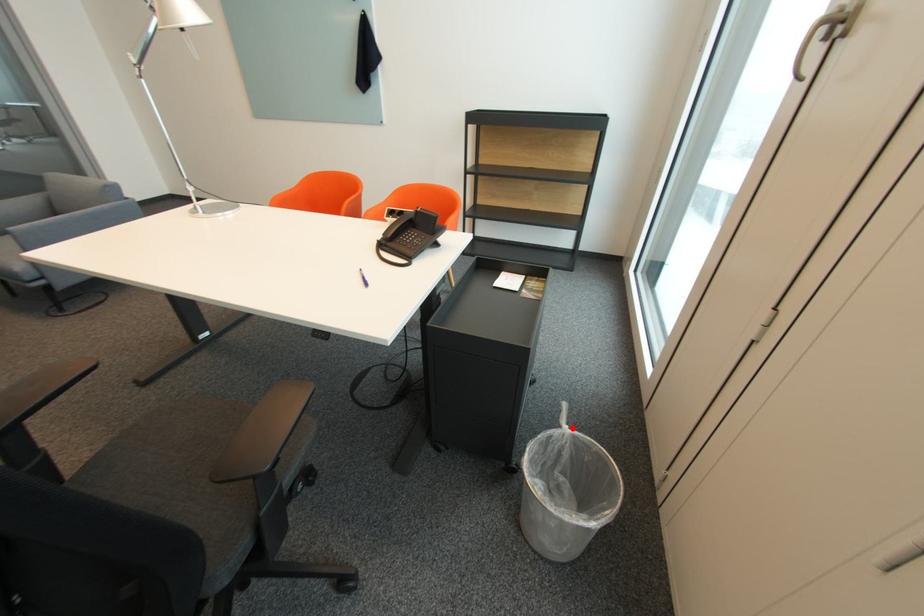
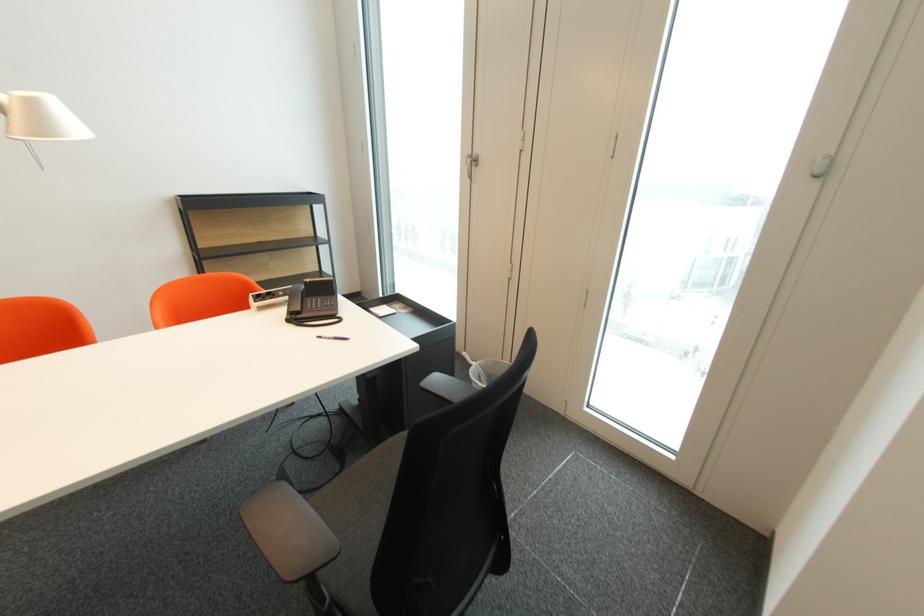
The point at the highlighted location is marked in the first image. Where is the corresponding point in the second image?

(480, 363)